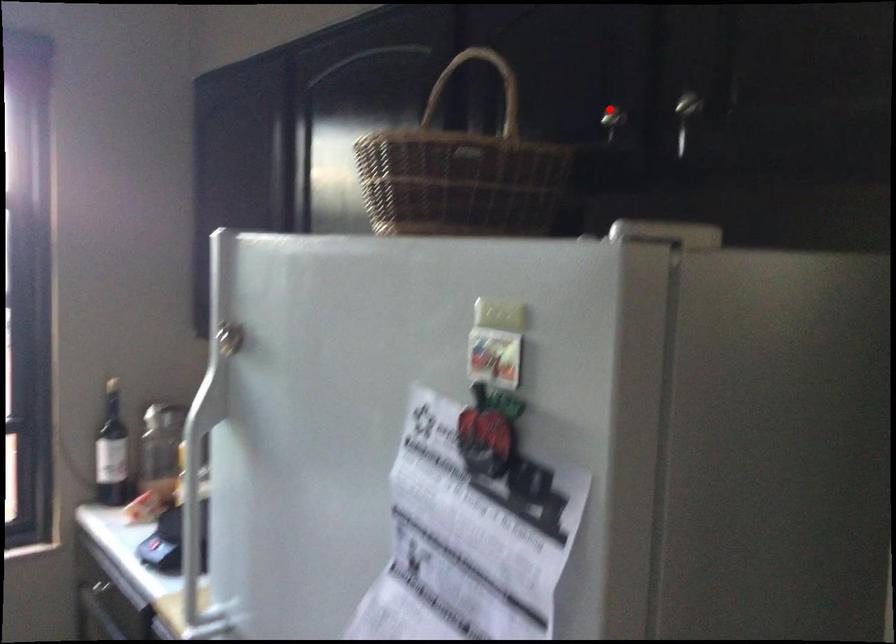
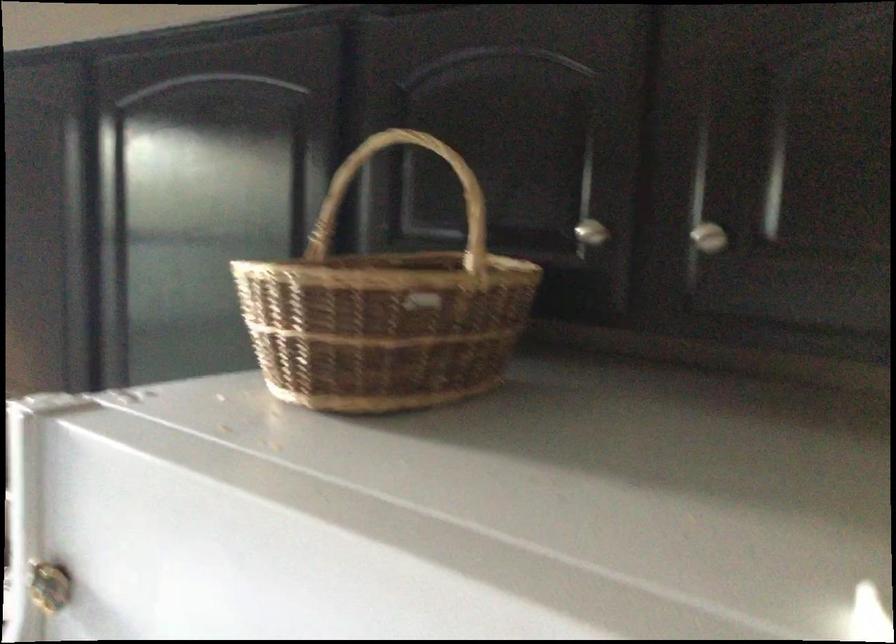
Question: I am providing you with two images of the same scene from different viewpoints. In image1, a red point is highlighted. Considering the same 3D point in image2, which of the following is correct?

Choices:
 (A) It is closer
 (B) It is farther

Answer: (A)